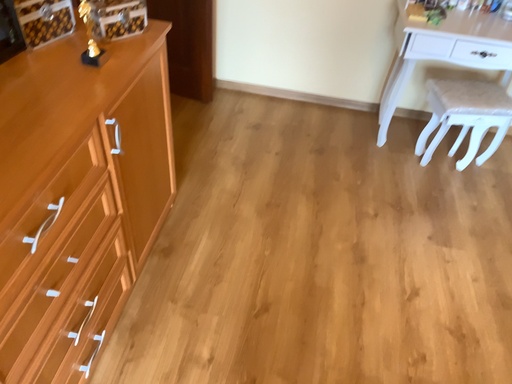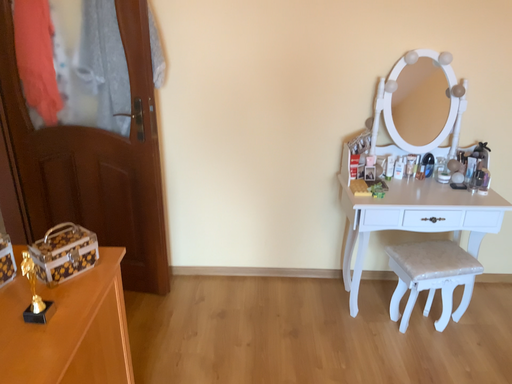
Question: Which way did the camera rotate in the video?

Choices:
 (A) rotated downward
 (B) rotated upward

Answer: (B)